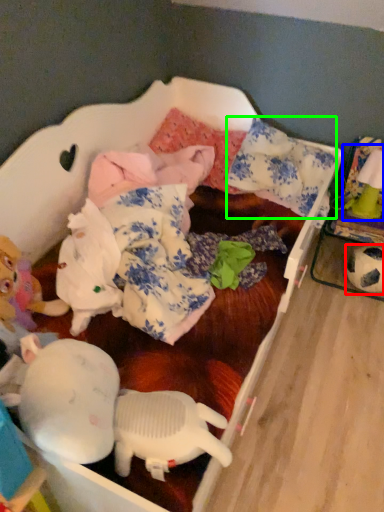
Question: Which is farther away from toy (highlighted by a red box)? toy (highlighted by a blue box) or pillow (highlighted by a green box)?

Choices:
 (A) toy
 (B) pillow

Answer: (B)